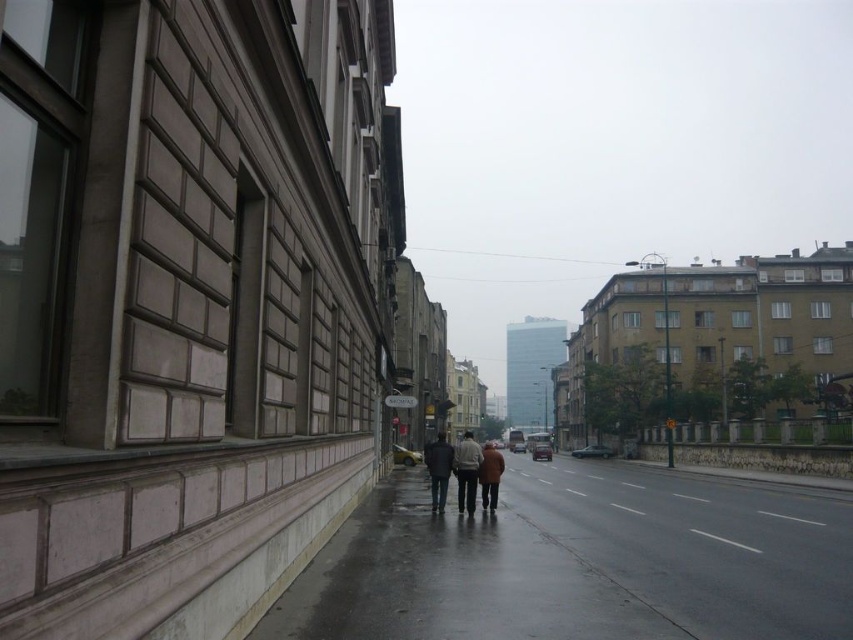
Is concrete sidewalk at lower center thinner than dark gray coat at center?

No, concrete sidewalk at lower center is not thinner than dark gray coat at center.

Who is higher up, concrete sidewalk at lower center or dark gray coat at center?

Positioned higher is concrete sidewalk at lower center.

Is point (573, 470) behind point (448, 445)?

Yes, point (573, 470) is behind point (448, 445).

Image resolution: width=853 pixels, height=640 pixels. I want to click on concrete sidewalk at lower center, so click(579, 561).

What do you see at coordinates (438, 468) in the screenshot? I see `dark gray coat at center` at bounding box center [438, 468].

Identify the location of dark gray coat at center. This screenshot has width=853, height=640. (438, 468).

Where is `dark gray coat at center`? The width and height of the screenshot is (853, 640). dark gray coat at center is located at coordinates (438, 468).

Who is taller, dark brown leather jacket at center or brown wool coat at center?

brown wool coat at center

Between dark brown leather jacket at center and brown wool coat at center, which one is positioned higher?

dark brown leather jacket at center

Which is in front, point (459, 477) or point (486, 497)?

Point (459, 477) is more forward.

Locate an element on the screen. Image resolution: width=853 pixels, height=640 pixels. dark brown leather jacket at center is located at coordinates (457, 468).